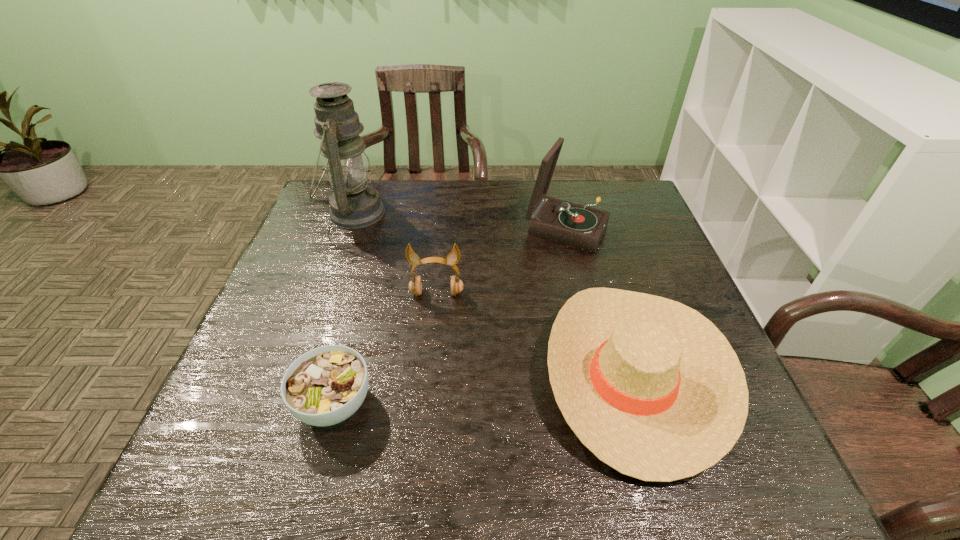
Identify the location of object present at the near right corner. The height and width of the screenshot is (540, 960). (x=650, y=386).

In the image, there is a desktop. In order to click on vacant space at the far edge in this screenshot , I will do `click(412, 205)`.

Identify the location of free region at the left edge. click(x=249, y=345).

This screenshot has width=960, height=540. What are the coordinates of `vacant space at the far right corner of the desktop` in the screenshot? It's located at (607, 184).

Locate an element on the screen. The height and width of the screenshot is (540, 960). free space at the near right corner of the desktop is located at coordinates (756, 469).

What are the coordinates of `free spot between the phonograph record and the third object from left to right` in the screenshot? It's located at (501, 261).

The width and height of the screenshot is (960, 540). What are the coordinates of `free point between the sunhat and the shortest object` in the screenshot? It's located at (485, 389).

Image resolution: width=960 pixels, height=540 pixels. I want to click on free area in between the oil lamp and the shortest object, so click(x=345, y=308).

I want to click on vacant space that is in between the earphone and the second shortest object, so click(536, 334).

You are a GUI agent. You are given a task and a screenshot of the screen. Output one action in this format:
    pyautogui.click(x=<x>, y=<y>)
    Task: Click on the free point between the second shortest object and the earphone
    
    Given the screenshot: What is the action you would take?
    pyautogui.click(x=536, y=334)